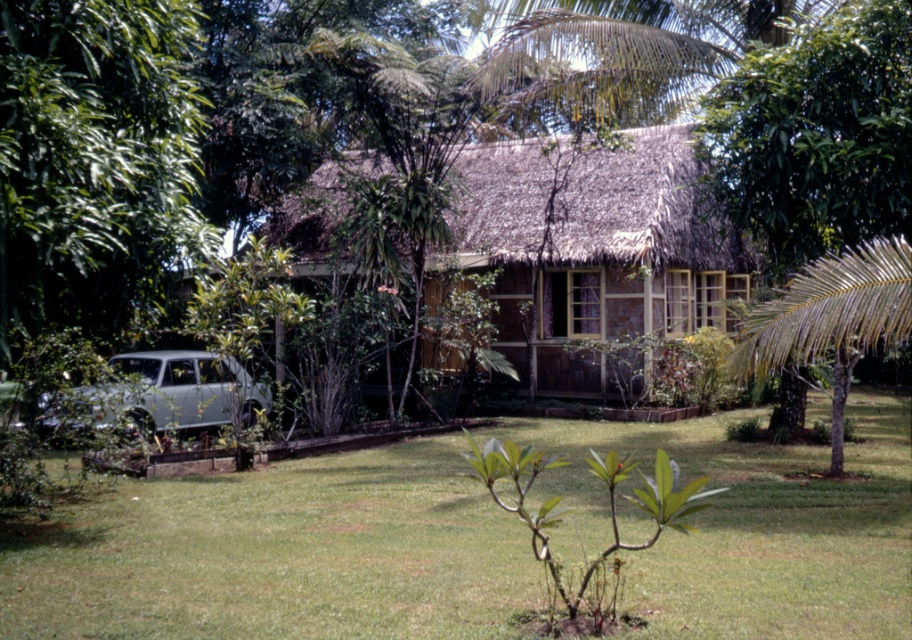
Question: Can you confirm if green grass at lower center is thinner than wooden cottage at center?

Choices:
 (A) no
 (B) yes

Answer: (B)

Question: Can you confirm if wooden cottage at center is positioned above green leafy tree at left?

Choices:
 (A) yes
 (B) no

Answer: (A)

Question: Does green grass at lower center appear on the left side of wooden cottage at center?

Choices:
 (A) yes
 (B) no

Answer: (A)

Question: Which of the following is the closest to the observer?

Choices:
 (A) (131, 388)
 (B) (98, 256)
 (C) (154, 566)

Answer: (B)

Question: Which of these objects is positioned closest to the green grass at lower center?

Choices:
 (A) wooden cottage at center
 (B) green leafy tree at left

Answer: (B)

Question: Based on their relative distances, which object is farther from the white matte car at lower left?

Choices:
 (A) green leafy tree at left
 (B) wooden cottage at center
 (C) green grass at lower center

Answer: (A)